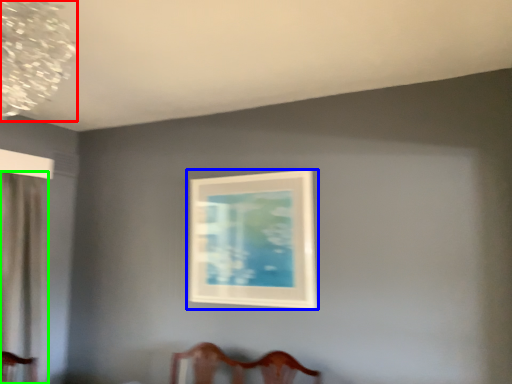
Question: Which is nearer to the lamp (highlighted by a red box)? picture frame (highlighted by a blue box) or curtain (highlighted by a green box).

Choices:
 (A) picture frame
 (B) curtain

Answer: (B)